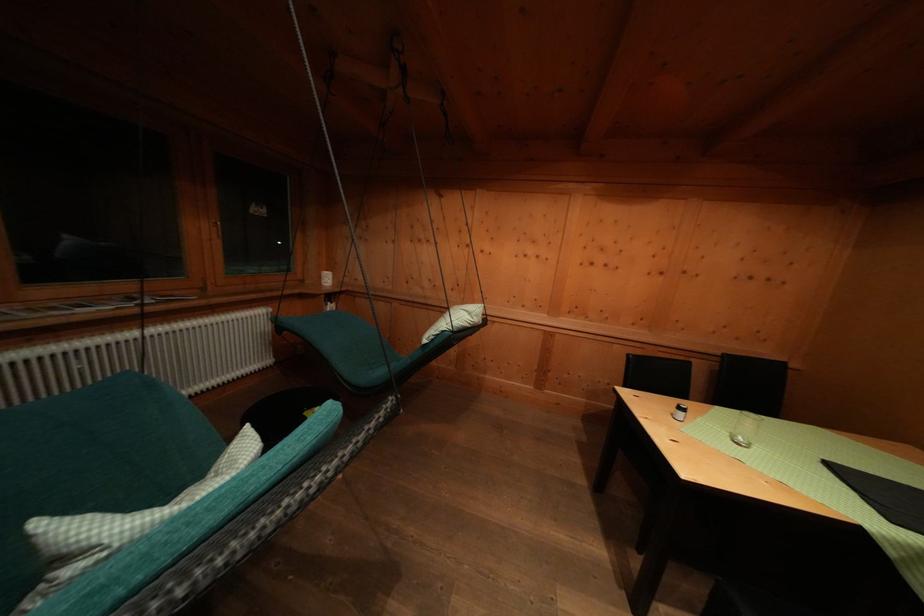
Identify the location of window handle. (213, 224).